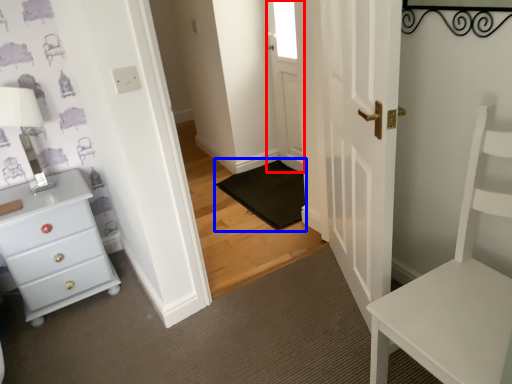
Question: Which object appears closest to the camera in this image, door (highlighted by a red box) or doormat (highlighted by a blue box)?

Choices:
 (A) door
 (B) doormat

Answer: (B)